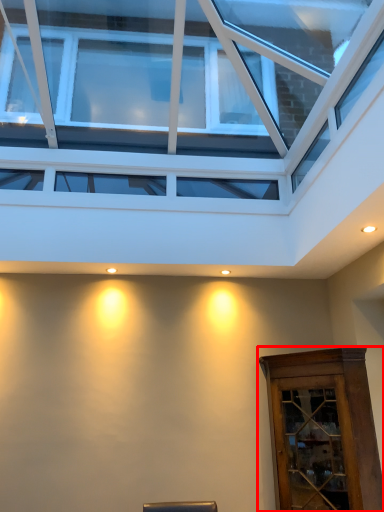
Question: In this image, where is elevator (annotated by the red box) located relative to window?

Choices:
 (A) left
 (B) right

Answer: (B)